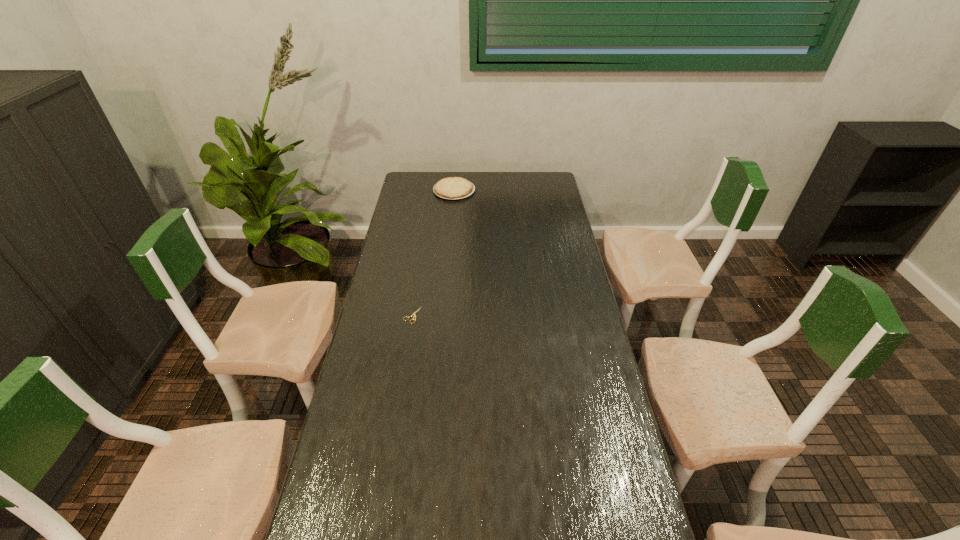
Find the location of `vacant space that satisfies the following two spatial constraints: 1. on the back side of the nearer object; 2. on the right side of the farther object`. vacant space that satisfies the following two spatial constraints: 1. on the back side of the nearer object; 2. on the right side of the farther object is located at coordinates (432, 191).